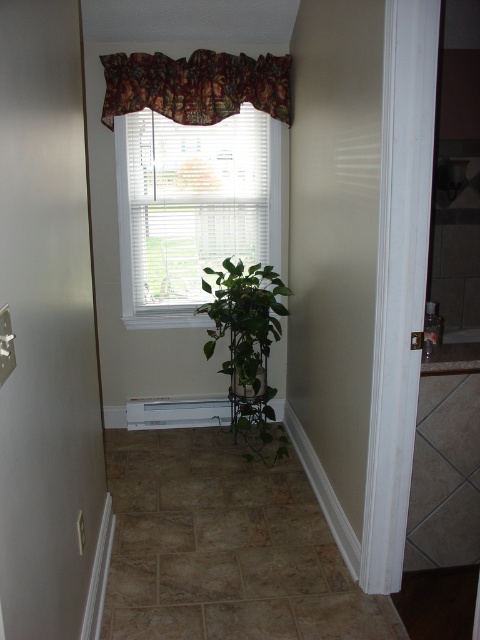
Which is behind, point (283, 100) or point (224, 369)?

Positioned behind is point (224, 369).

Is the position of floral fabric valance at upper center less distant than that of green matte plant at center?

No, it is not.

In order to click on floral fabric valance at upper center in this screenshot , I will do `click(195, 84)`.

Does white blinds at center appear under floral fabric valance at upper center?

Yes, white blinds at center is below floral fabric valance at upper center.

Is white blinds at center to the right of floral fabric valance at upper center from the viewer's perspective?

Incorrect, white blinds at center is not on the right side of floral fabric valance at upper center.

Locate an element on the screen. The height and width of the screenshot is (640, 480). white blinds at center is located at coordinates (192, 209).

Does white blinds at center have a greater width compared to green matte plant at center?

Yes, white blinds at center is wider than green matte plant at center.

Who is more forward, (178, 218) or (259, 432)?

Positioned in front is point (178, 218).

At what (x,y) coordinates should I click in order to perform the action: click on white blinds at center. Please return your answer as a coordinate pair (x, y). The height and width of the screenshot is (640, 480). Looking at the image, I should click on (192, 209).

In order to click on white blinds at center in this screenshot , I will do `click(192, 209)`.